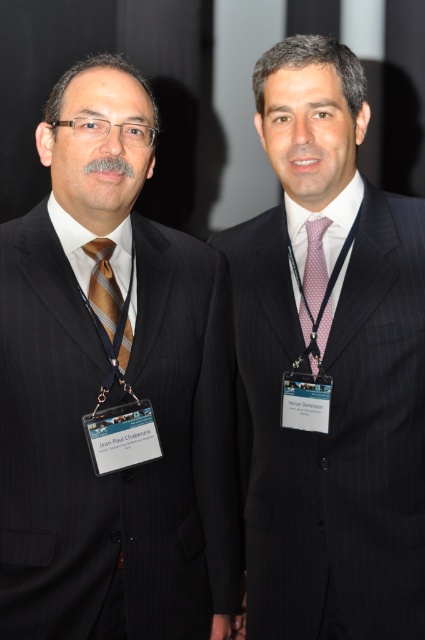
What do you see at coordinates (113, 388) in the screenshot? The height and width of the screenshot is (640, 425). I see `pinstriped suit at left` at bounding box center [113, 388].

Is point (27, 520) positioned before point (300, 321)?

Yes, point (27, 520) is closer to viewer.

Between point (153, 108) and point (317, 225), which one is positioned in front?

Positioned in front is point (153, 108).

Identify the location of pinstriped suit at left. This screenshot has width=425, height=640. (113, 388).

Is pinstriped suit at left below brown striped tie at center?

Correct, pinstriped suit at left is located below brown striped tie at center.

Is pinstriped suit at left taller than brown striped tie at center?

Indeed, pinstriped suit at left has a greater height compared to brown striped tie at center.

At what (x,y) coordinates should I click in order to perform the action: click on pinstriped suit at left. Please return your answer as a coordinate pair (x, y). Image resolution: width=425 pixels, height=640 pixels. Looking at the image, I should click on (113, 388).

Can you confirm if pinstriped suit at center is positioned to the left of pink dotted fabric tie at center?

Correct, you'll find pinstriped suit at center to the left of pink dotted fabric tie at center.

Where is `pinstriped suit at center`? pinstriped suit at center is located at coordinates (331, 369).